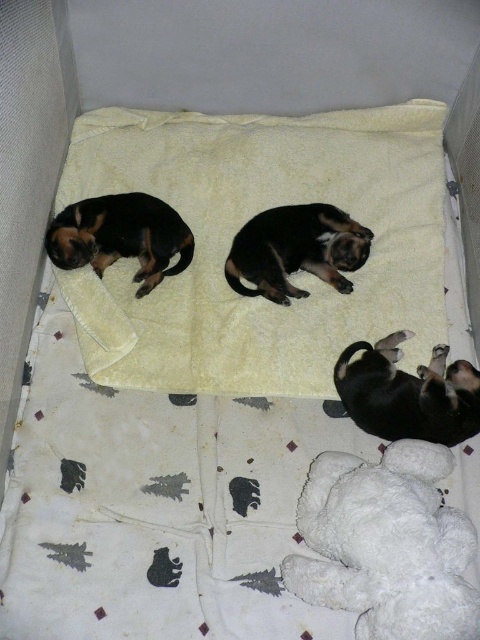
Does black fur dog at lower right come in front of black and tan fur at upper left?

Yes, it is.

Does black fur dog at lower right appear under black and tan fur at upper left?

Correct, black fur dog at lower right is located below black and tan fur at upper left.

Who is more distant from viewer, (x=394, y=413) or (x=139, y=296)?

The point (x=139, y=296) is more distant.

Find the location of `black fur dog at lower right`. black fur dog at lower right is located at coordinates (408, 394).

Can you confirm if black fur dog at lower right is positioned to the right of black fur dog at center?

Indeed, black fur dog at lower right is positioned on the right side of black fur dog at center.

Is black fur dog at lower right wider than black fur dog at center?

In fact, black fur dog at lower right might be narrower than black fur dog at center.

Measure the distance between black fur dog at lower right and camera.

1.35 meters

The image size is (480, 640). I want to click on black fur dog at lower right, so click(408, 394).

Does yellow soft blanket at upper center appear over black fur dog at lower right?

Correct, yellow soft blanket at upper center is located above black fur dog at lower right.

Is yellow soft blanket at upper center thinner than black fur dog at lower right?

No.

The height and width of the screenshot is (640, 480). What do you see at coordinates (240, 225) in the screenshot? I see `yellow soft blanket at upper center` at bounding box center [240, 225].

Where is `yellow soft blanket at upper center`? yellow soft blanket at upper center is located at coordinates (240, 225).